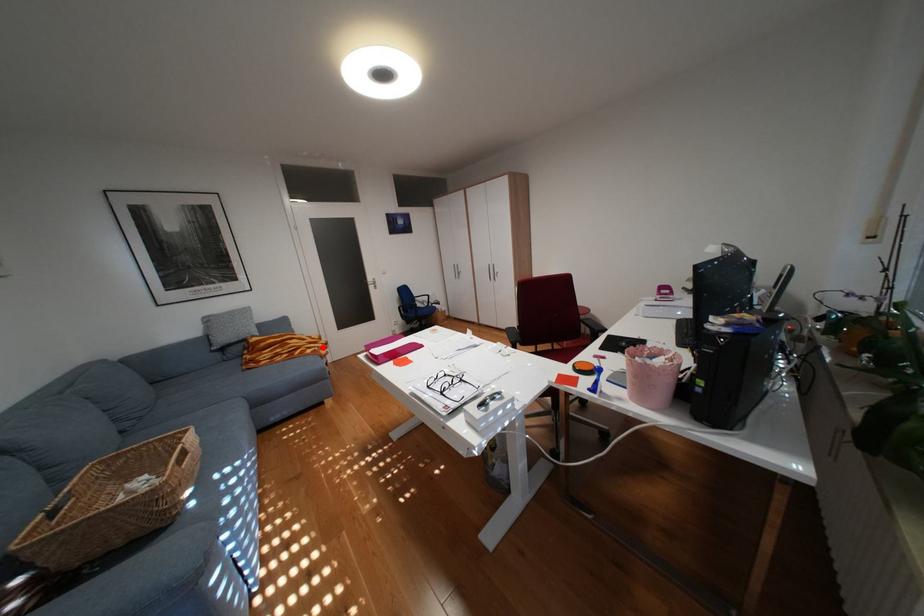
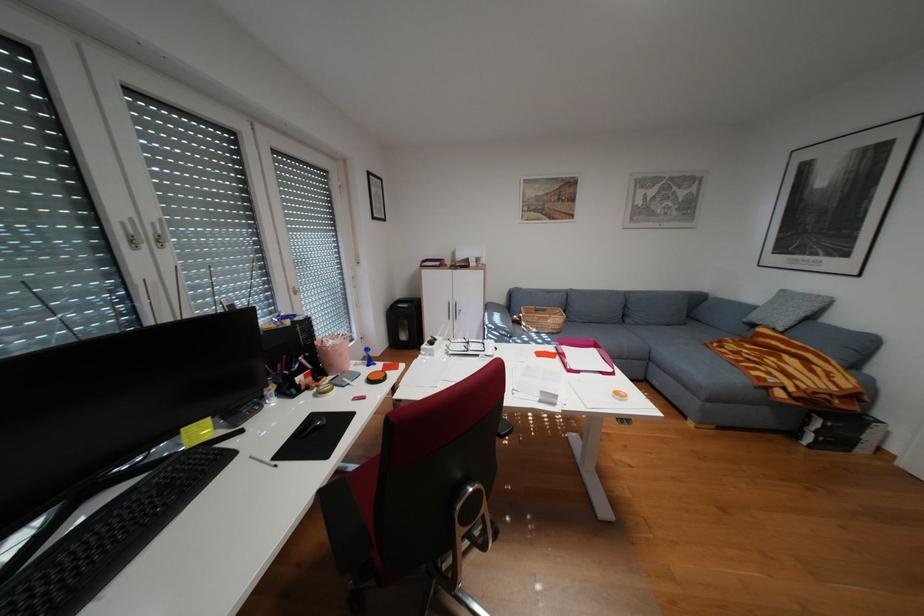
Find the pixel in the second image that matches the highlighted location in the first image.

(782, 373)